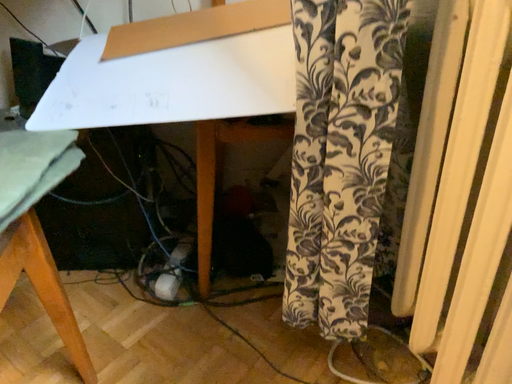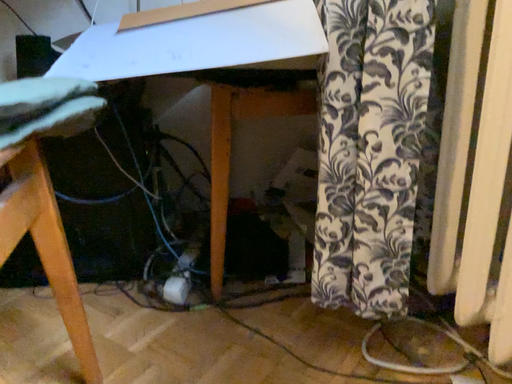
Question: How did the camera likely rotate when shooting the video?

Choices:
 (A) rotated upward
 (B) rotated downward

Answer: (A)